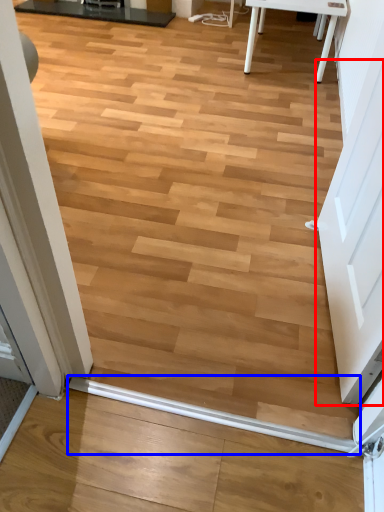
Question: Which object appears farthest to the camera in this image, screen door (highlighted by a red box) or beam (highlighted by a blue box)?

Choices:
 (A) screen door
 (B) beam

Answer: (B)